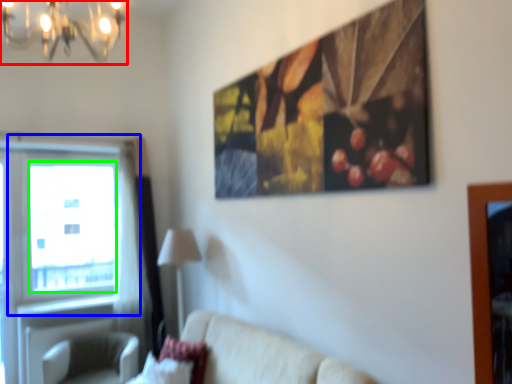
Question: Based on their relative distances, which object is farther from light fixture (highlighted by a red box)? Choose from window (highlighted by a blue box) and window screen (highlighted by a green box).

Choices:
 (A) window
 (B) window screen

Answer: (B)